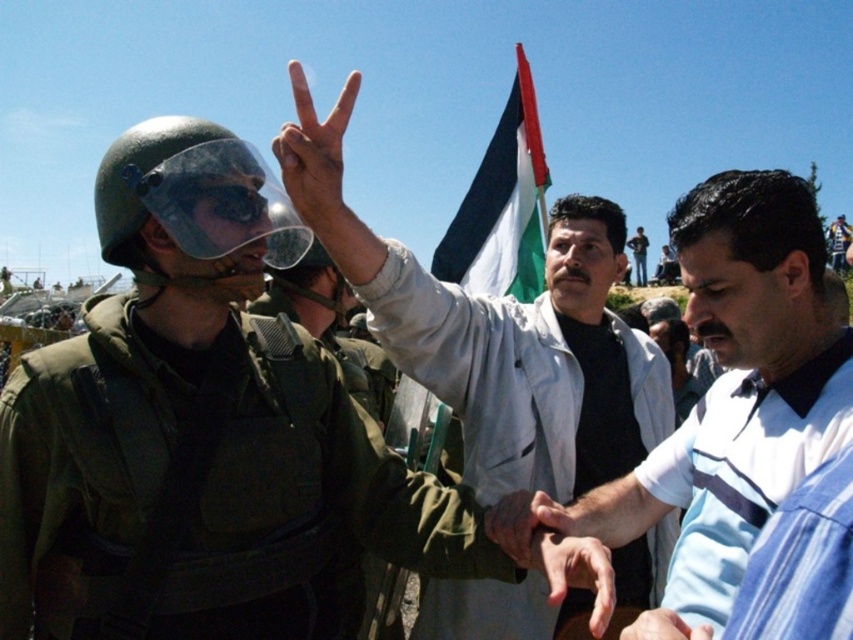
Question: Which is farther from the transparent plastic goggles at center?

Choices:
 (A) white striped polo shirt at center
 (B) light gray jacket at center
 (C) matte green helmet at left
 (D) striped polo shirt at right

Answer: (B)

Question: Can you confirm if matte green helmet at upper left is positioned above transparent plastic goggles at center?

Choices:
 (A) no
 (B) yes

Answer: (A)

Question: Considering the relative positions of white fabric flag at upper center and transparent plastic goggles at center in the image provided, where is white fabric flag at upper center located with respect to transparent plastic goggles at center?

Choices:
 (A) left
 (B) right

Answer: (B)

Question: Which object is the closest to the matte black hand at center?

Choices:
 (A) light gray jacket at center
 (B) white fabric flag at upper center
 (C) striped polo shirt at right
 (D) white striped polo shirt at center

Answer: (D)

Question: Can you confirm if matte green helmet at upper left is positioned below matte black hand at center?

Choices:
 (A) no
 (B) yes

Answer: (B)

Question: Which object appears closest to the camera in this image?

Choices:
 (A) matte green helmet at left
 (B) striped polo shirt at right

Answer: (A)